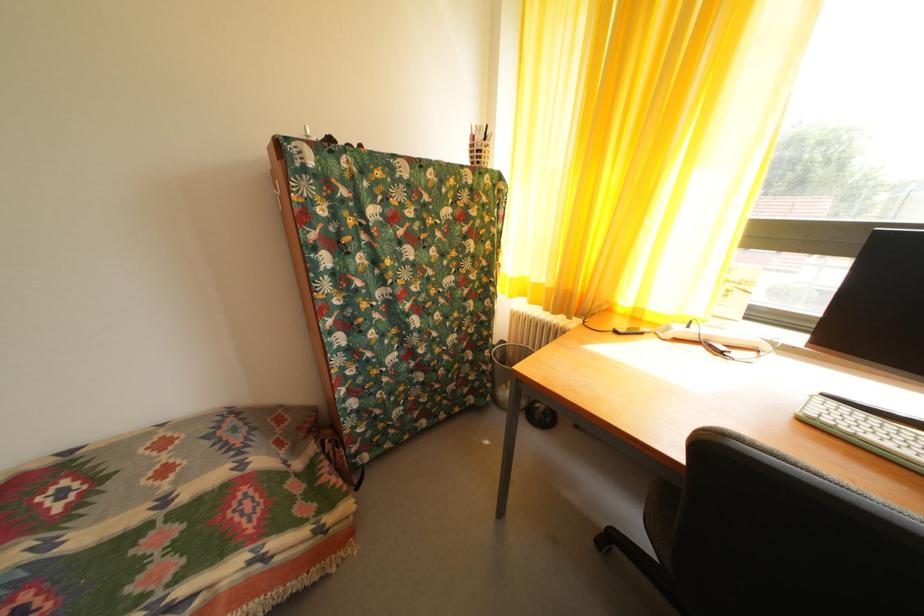
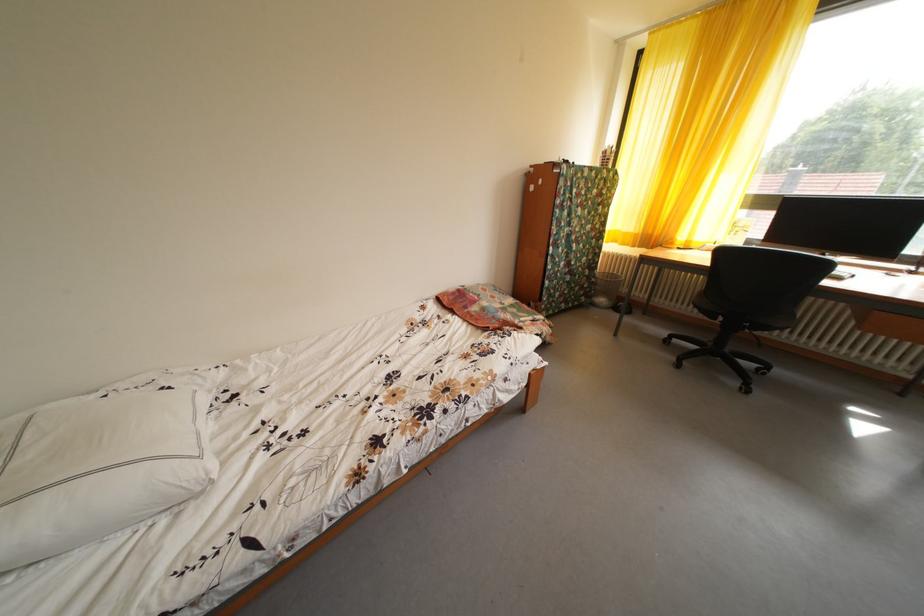
What movement of the cameraman would produce the second image?

The movement direction of the cameraman is left, backward.